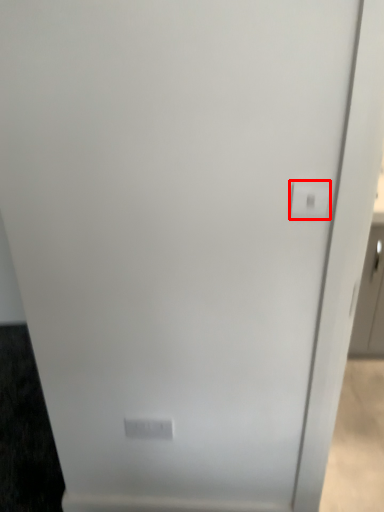
Question: Where is light switch (annotated by the red box) located in relation to light switch in the image?

Choices:
 (A) left
 (B) right

Answer: (B)